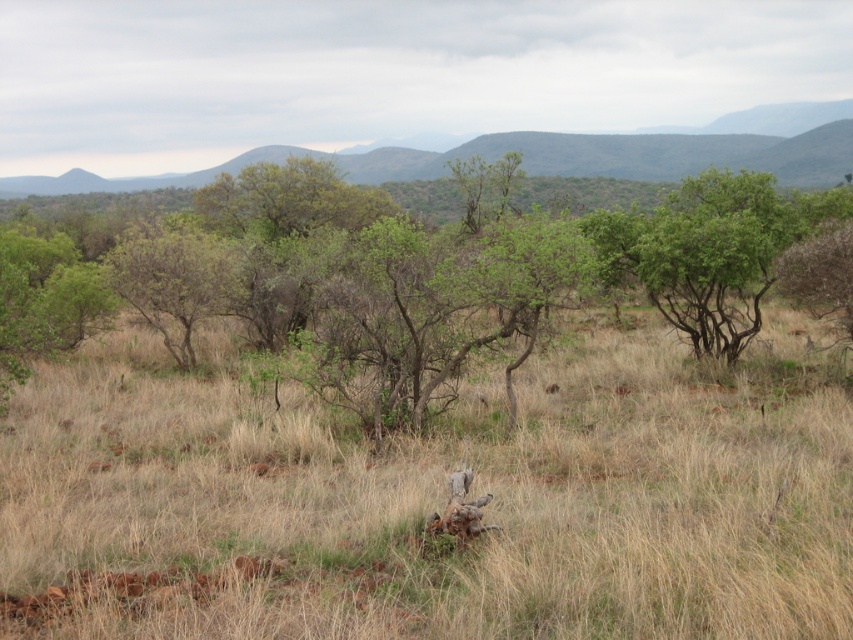
You are a bird looking for a nesting spot. You see a green leafy tree at center and a green leafy shrub at center. Which one would provide a higher nesting position?

The green leafy tree at center has a greater height compared to the green leafy shrub at center, so it would provide a higher nesting position.

You are standing at the point marked by coordinates point (447,273) in the savanna landscape. Looking around, what do you see immediately in front of you?

You see a green leafy tree at center immediately in front of you.

You are standing in the savanna landscape and see two points marked in the image. Which point, point (190, 365) or point (193, 365), is closer to you?

Point (190, 365) is closer to the viewer than point (193, 365).